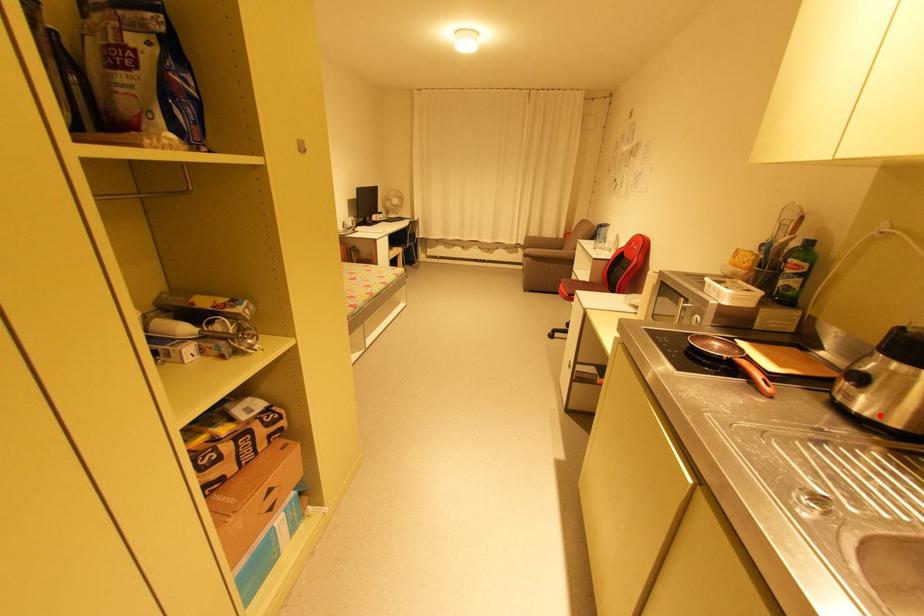
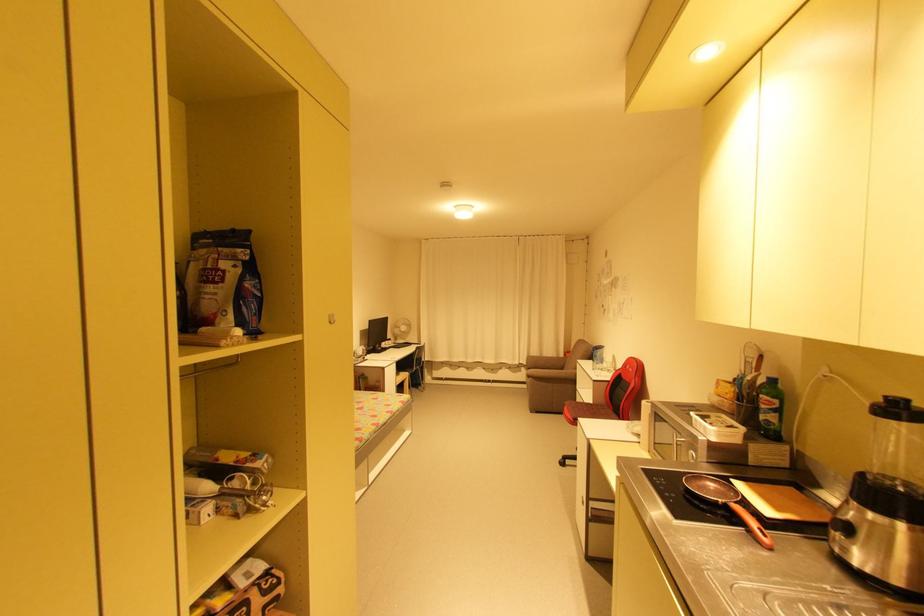
The point at the highlighted location is marked in the first image. Where is the corresponding point in the second image?

(878, 570)